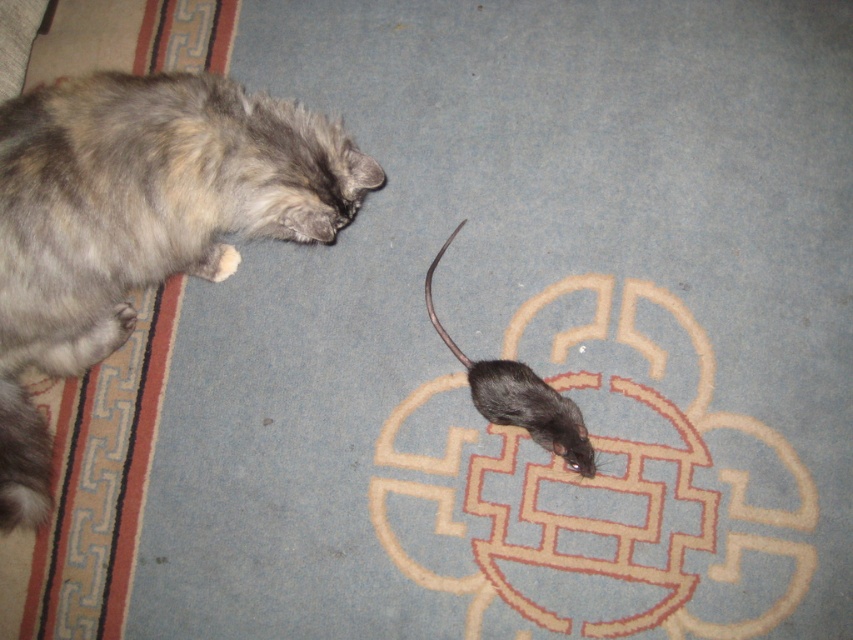
Question: Which point is closer to the camera taking this photo?

Choices:
 (A) (276, 168)
 (B) (473, 369)

Answer: (A)

Question: Which object is closer to the camera taking this photo?

Choices:
 (A) gray fluffy cat at left
 (B) black matte mouse at center

Answer: (A)

Question: Does gray fluffy cat at left have a smaller size compared to black matte mouse at center?

Choices:
 (A) yes
 (B) no

Answer: (B)

Question: Which of the following is the closest to the observer?

Choices:
 (A) gray fluffy cat at left
 (B) black matte mouse at center

Answer: (A)

Question: Does gray fluffy cat at left have a greater width compared to black matte mouse at center?

Choices:
 (A) yes
 (B) no

Answer: (A)

Question: Considering the relative positions of gray fluffy cat at left and black matte mouse at center in the image provided, where is gray fluffy cat at left located with respect to black matte mouse at center?

Choices:
 (A) left
 (B) right

Answer: (A)